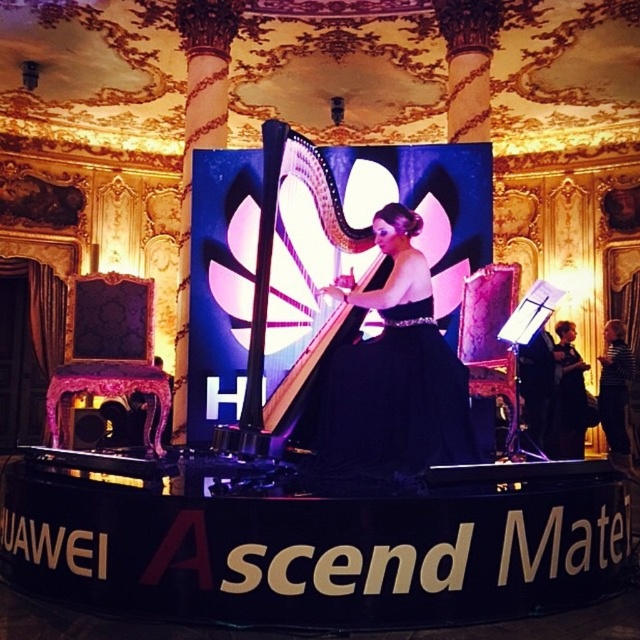
Question: Does black satin dress at center have a smaller size compared to shiny silver harp at center?

Choices:
 (A) yes
 (B) no

Answer: (B)

Question: Does black satin dress at center have a smaller size compared to shiny silver harp at center?

Choices:
 (A) yes
 (B) no

Answer: (B)

Question: Which of the following is the farthest from the observer?

Choices:
 (A) shiny silver harp at center
 (B) black satin dress at center

Answer: (A)

Question: Considering the relative positions of black satin dress at center and shiny silver harp at center in the image provided, where is black satin dress at center located with respect to shiny silver harp at center?

Choices:
 (A) below
 (B) above

Answer: (A)